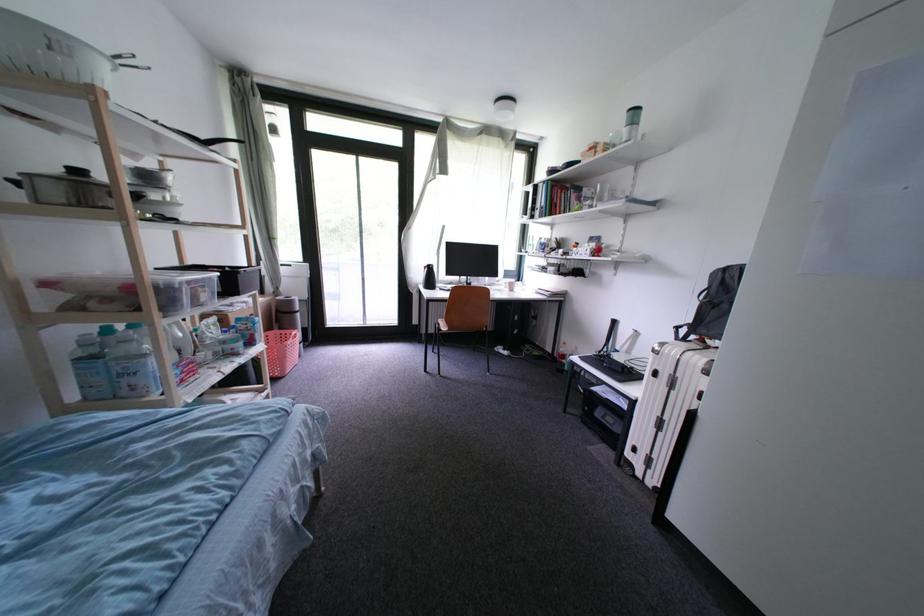
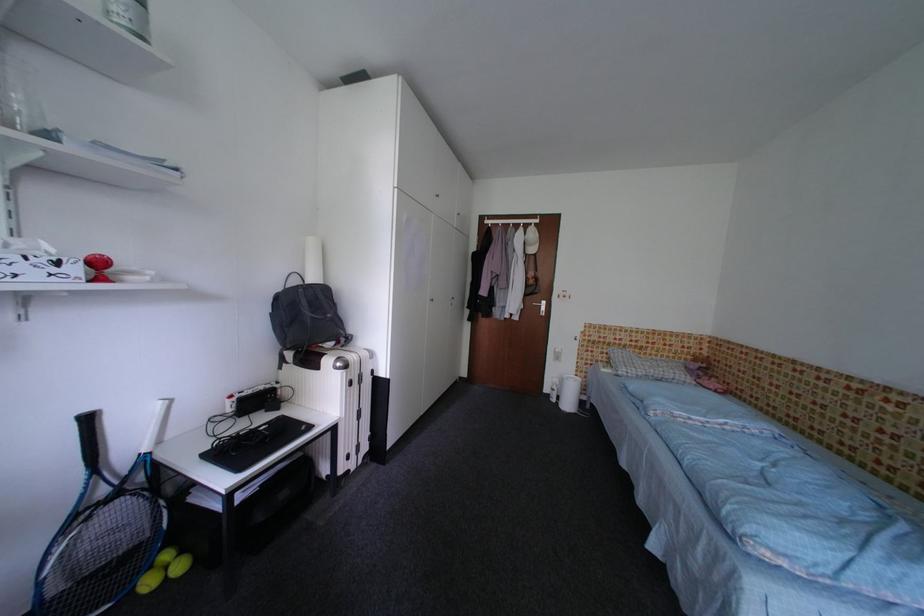
In the second image, find the point that corresponds to point 663,377 in the first image.

(359, 386)